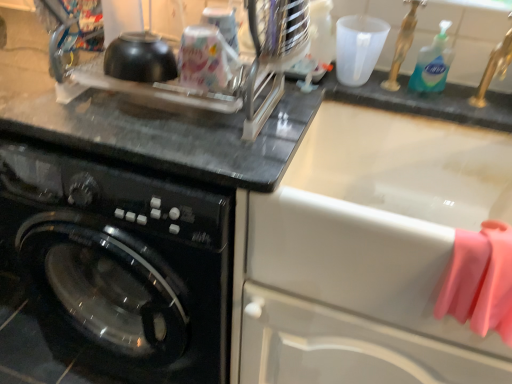
Question: Does black glossy washing machine at left appear on the left side of blue liquid soap at upper right?

Choices:
 (A) yes
 (B) no

Answer: (A)

Question: Could you tell me if black glossy washing machine at left is facing blue liquid soap at upper right?

Choices:
 (A) no
 (B) yes

Answer: (A)

Question: Considering the relative sizes of black glossy washing machine at left and blue liquid soap at upper right in the image provided, is black glossy washing machine at left taller than blue liquid soap at upper right?

Choices:
 (A) yes
 (B) no

Answer: (A)

Question: Can you confirm if black glossy washing machine at left is wider than blue liquid soap at upper right?

Choices:
 (A) no
 (B) yes

Answer: (B)

Question: Is blue liquid soap at upper right located within black glossy washing machine at left?

Choices:
 (A) no
 (B) yes

Answer: (A)

Question: Is point (310, 289) positioned closer to the camera than point (418, 66)?

Choices:
 (A) closer
 (B) farther

Answer: (A)

Question: Looking at the image, does white glossy sink at upper right seem bigger or smaller compared to blue liquid soap at upper right?

Choices:
 (A) big
 (B) small

Answer: (A)

Question: Is white glossy sink at upper right taller or shorter than blue liquid soap at upper right?

Choices:
 (A) tall
 (B) short

Answer: (A)

Question: In the image, is white glossy sink at upper right on the left side or the right side of blue liquid soap at upper right?

Choices:
 (A) right
 (B) left

Answer: (B)

Question: Relative to pink rubber gloves at right, is black glossy washing machine at left in front or behind?

Choices:
 (A) behind
 (B) front

Answer: (A)

Question: From the image's perspective, is black glossy washing machine at left positioned above or below pink rubber gloves at right?

Choices:
 (A) above
 (B) below

Answer: (A)

Question: Considering the positions of point (59, 261) and point (466, 235), is point (59, 261) closer or farther from the camera than point (466, 235)?

Choices:
 (A) farther
 (B) closer

Answer: (A)

Question: Would you say black glossy washing machine at left is to the left or to the right of pink rubber gloves at right in the picture?

Choices:
 (A) left
 (B) right

Answer: (A)

Question: Is black glossy washing machine at left bigger or smaller than white glossy sink at upper right?

Choices:
 (A) big
 (B) small

Answer: (A)

Question: Does point (48, 198) appear closer or farther from the camera than point (412, 329)?

Choices:
 (A) closer
 (B) farther

Answer: (B)